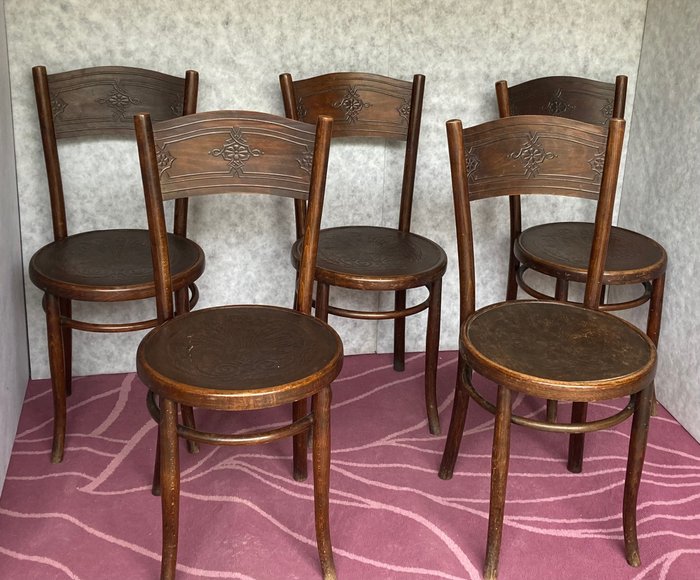
Find the location of a particular element. Image resolution: width=700 pixels, height=580 pixels. chair is located at coordinates (112, 248), (229, 346), (365, 248), (542, 331), (575, 245).